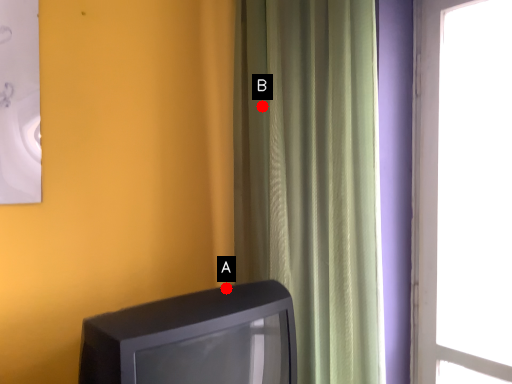
Question: Two points are circled on the image, labeled by A and B beside each circle. Which point is farther to the camera?

Choices:
 (A) A is further
 (B) B is further

Answer: (B)